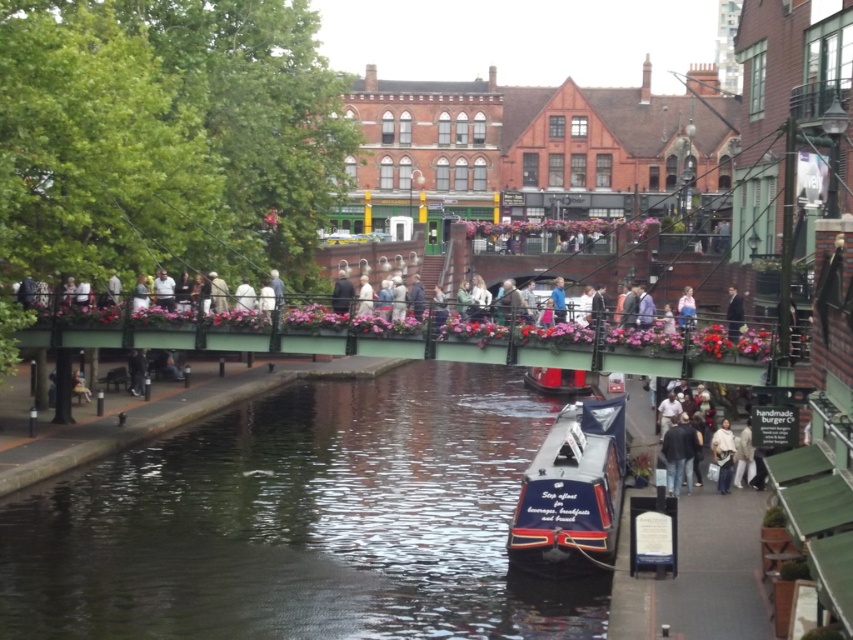
Between blue polished wood boat at center and light beige jacket at center, which one has more height?

blue polished wood boat at center is taller.

Is blue polished wood boat at center below light beige jacket at center?

Correct, blue polished wood boat at center is located below light beige jacket at center.

Who is more distant from viewer, (535, 490) or (360, 284)?

Point (360, 284)

Find the location of a particular element. Image resolution: width=853 pixels, height=640 pixels. blue polished wood boat at center is located at coordinates (572, 492).

Does white fabric bag at lower right have a lesser width compared to white cotton jacket at lower right?

Incorrect, white fabric bag at lower right's width is not less than white cotton jacket at lower right's.

Does white fabric bag at lower right have a larger size compared to white cotton jacket at lower right?

Yes, white fabric bag at lower right is bigger than white cotton jacket at lower right.

Is point (717, 445) positioned after point (735, 481)?

Yes, point (717, 445) is farther from viewer.

In order to click on white fabric bag at lower right in this screenshot , I will do `click(723, 456)`.

Is dark blue water at center positioned behind white fabric shirt at upper center?

No, dark blue water at center is closer to the viewer.

Does dark blue water at center have a greater height compared to white fabric shirt at upper center?

Yes, dark blue water at center is taller than white fabric shirt at upper center.

Between point (583, 595) and point (688, 312), which one is positioned behind?

Positioned behind is point (688, 312).

Identify the location of dark blue water at center. This screenshot has width=853, height=640. (300, 522).